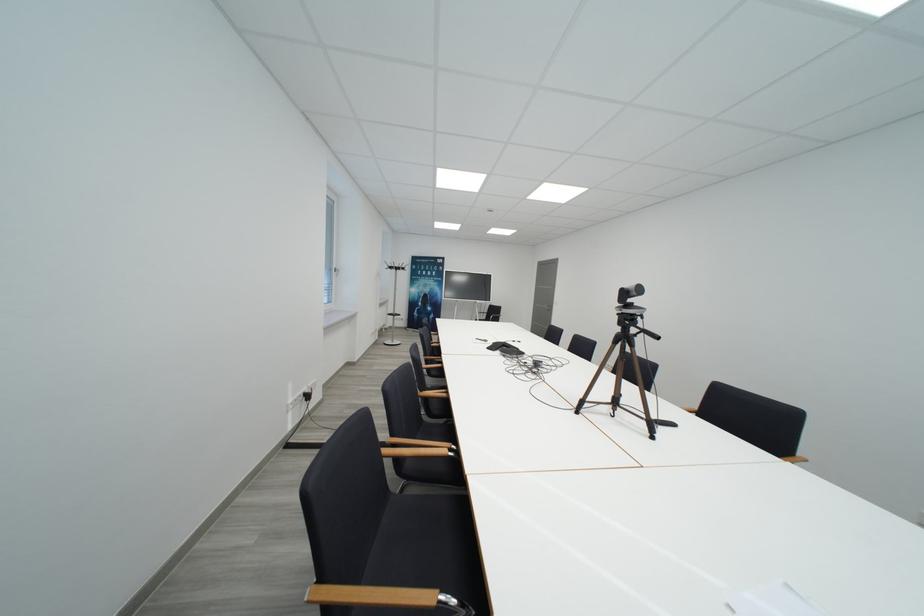
Describe the element at coordinates (307, 394) in the screenshot. The image size is (924, 616). I see `the black power plug` at that location.